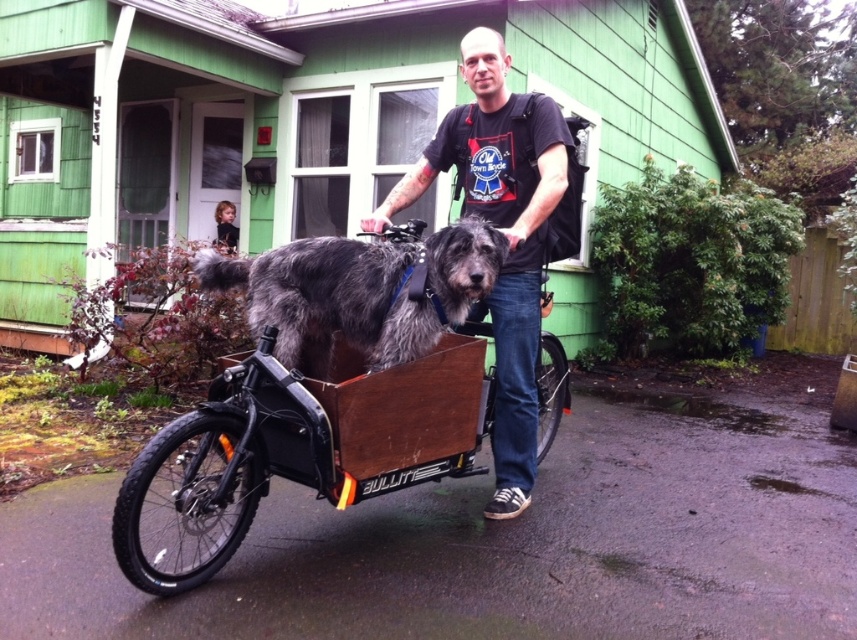
You need to determine if the gray woolen dog at center can fit inside the wooden box at center. Based on their sizes, what is your conclusion?

The gray woolen dog at center has a greater width than the wooden box at center, so the dog cannot fit inside the wooden box at center.

You are a photographer trying to capture the best angle of the cargo bike and the dog. You notice two points marked on the image at coordinates point (510, 474) and point (548, 365). Which point is closer to your camera lens?

Point (510, 474) is closer to the camera than point (548, 365).

You are a photographer taking a picture of the scene. You need to focus on the point at coordinates point [502,232]. What object is located at that point?

The point [502,232] corresponds to the matte black t shirt at center.